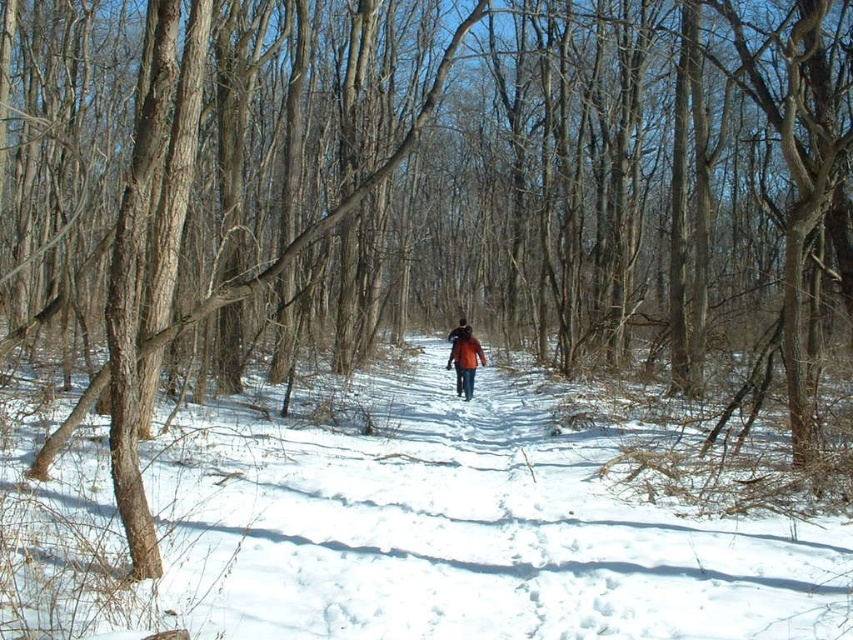
Question: Does white powdery snow at center lie behind orange fabric jacket at center?

Choices:
 (A) no
 (B) yes

Answer: (A)

Question: Which point is closer to the camera taking this photo?

Choices:
 (A) (395, 582)
 (B) (459, 365)

Answer: (A)

Question: Is white powdery snow at center wider than orange fabric jacket at center?

Choices:
 (A) no
 (B) yes

Answer: (B)

Question: Can you confirm if white powdery snow at center is smaller than orange fabric jacket at center?

Choices:
 (A) yes
 (B) no

Answer: (B)